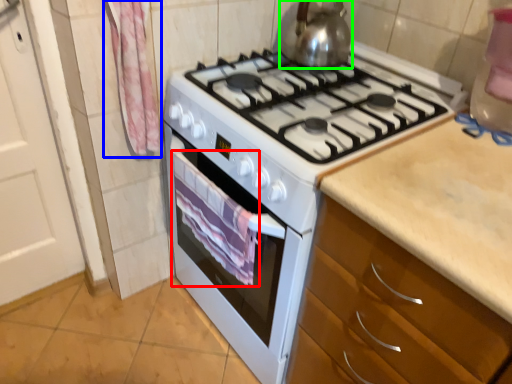
Question: Which is farther away from blanket (highlighted by a red box)? curtain (highlighted by a blue box) or kitchen appliance (highlighted by a green box)?

Choices:
 (A) curtain
 (B) kitchen appliance

Answer: (B)